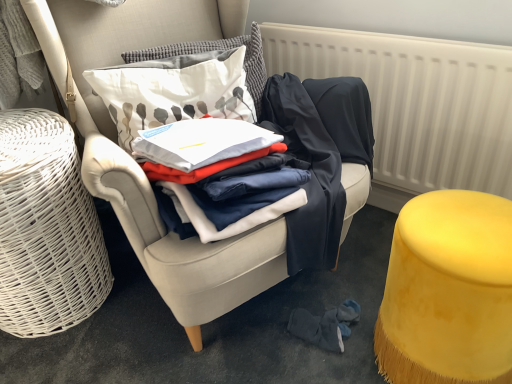
Question: Does white wicker basket at left have a greater height compared to velvet yellow stool at lower right?

Choices:
 (A) no
 (B) yes

Answer: (B)

Question: Would you say white wicker basket at left is a long distance from velvet yellow stool at lower right?

Choices:
 (A) no
 (B) yes

Answer: (A)

Question: Is white wicker basket at left outside of velvet yellow stool at lower right?

Choices:
 (A) no
 (B) yes

Answer: (B)

Question: Is velvet yellow stool at lower right inside white wicker basket at left?

Choices:
 (A) yes
 (B) no

Answer: (B)

Question: Is white wicker basket at left in front of velvet yellow stool at lower right?

Choices:
 (A) yes
 (B) no

Answer: (B)

Question: Considering the relative sizes of white wicker basket at left and velvet yellow stool at lower right in the image provided, is white wicker basket at left bigger than velvet yellow stool at lower right?

Choices:
 (A) yes
 (B) no

Answer: (A)

Question: From the image's perspective, is white printed cushion at upper center, the 2th pillow when ordered from top to bottom, over white cotton pillow at upper center, arranged as the first pillow when viewed from the top?

Choices:
 (A) no
 (B) yes

Answer: (A)

Question: Does white printed cushion at upper center, positioned as the 1th pillow in bottom-to-top order, come in front of white cotton pillow at upper center, which ranks as the second pillow in bottom-to-top order?

Choices:
 (A) yes
 (B) no

Answer: (A)

Question: Is white printed cushion at upper center, the 2th pillow when ordered from top to bottom, touching white cotton pillow at upper center, which ranks as the second pillow in bottom-to-top order?

Choices:
 (A) yes
 (B) no

Answer: (B)

Question: Can you confirm if white printed cushion at upper center, positioned as the 1th pillow in bottom-to-top order, is thinner than white cotton pillow at upper center, which ranks as the second pillow in bottom-to-top order?

Choices:
 (A) yes
 (B) no

Answer: (B)

Question: From the image's perspective, does white printed cushion at upper center, the 2th pillow when ordered from top to bottom, appear lower than white cotton pillow at upper center, which ranks as the second pillow in bottom-to-top order?

Choices:
 (A) yes
 (B) no

Answer: (A)

Question: From a real-world perspective, is white printed cushion at upper center, positioned as the 1th pillow in bottom-to-top order, on white cotton pillow at upper center, arranged as the first pillow when viewed from the top?

Choices:
 (A) yes
 (B) no

Answer: (B)

Question: Would you say white textured radiator at upper right is a long distance from white printed cushion at upper center, the 2th pillow when ordered from top to bottom?

Choices:
 (A) no
 (B) yes

Answer: (A)